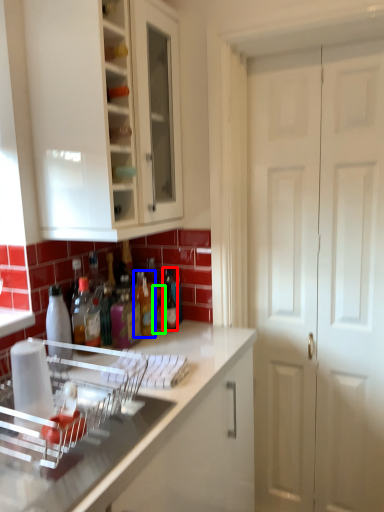
Question: Which is farther away from bottle (highlighted by a red box)? bottle (highlighted by a blue box) or bottle (highlighted by a green box)?

Choices:
 (A) bottle
 (B) bottle

Answer: (A)